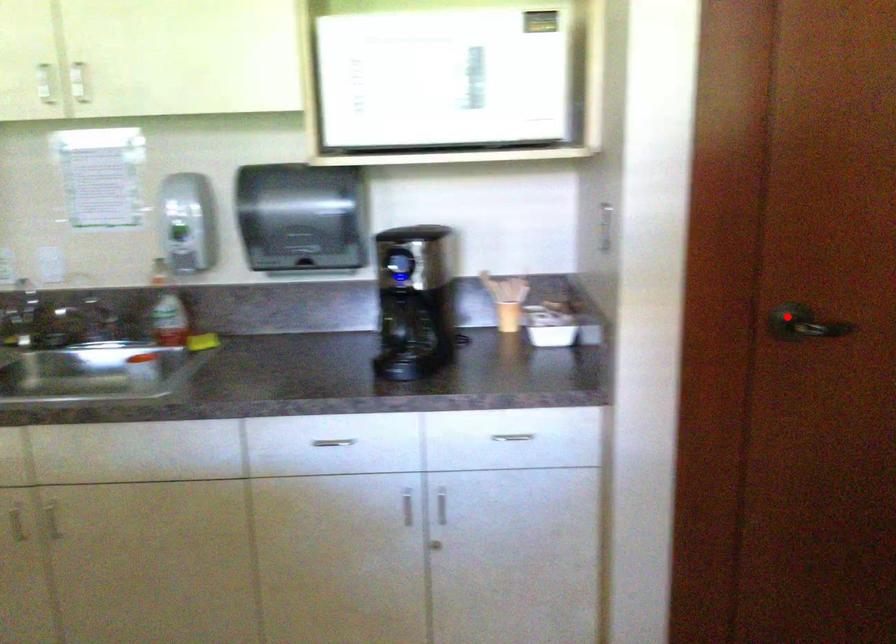
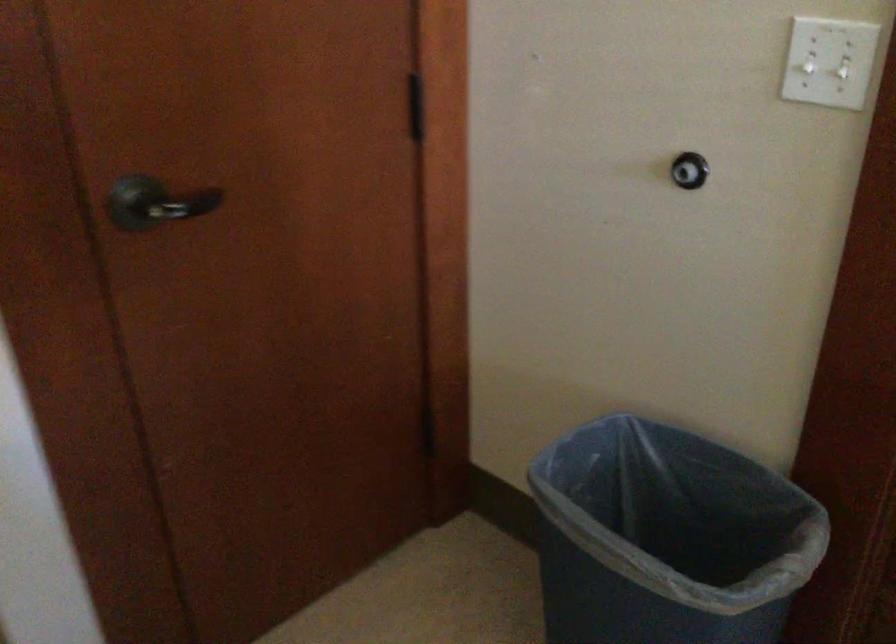
Question: I am providing you with two images of the same scene from different viewpoints. A red point is shown in image1. For the corresponding object point in image2, is it positioned nearer or farther from the camera?

Choices:
 (A) Nearer
 (B) Farther

Answer: (A)